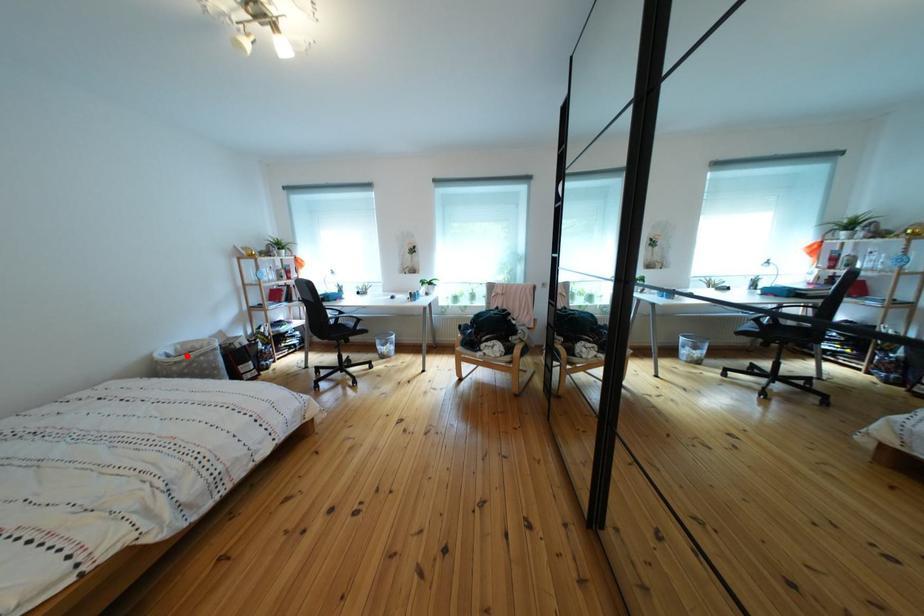
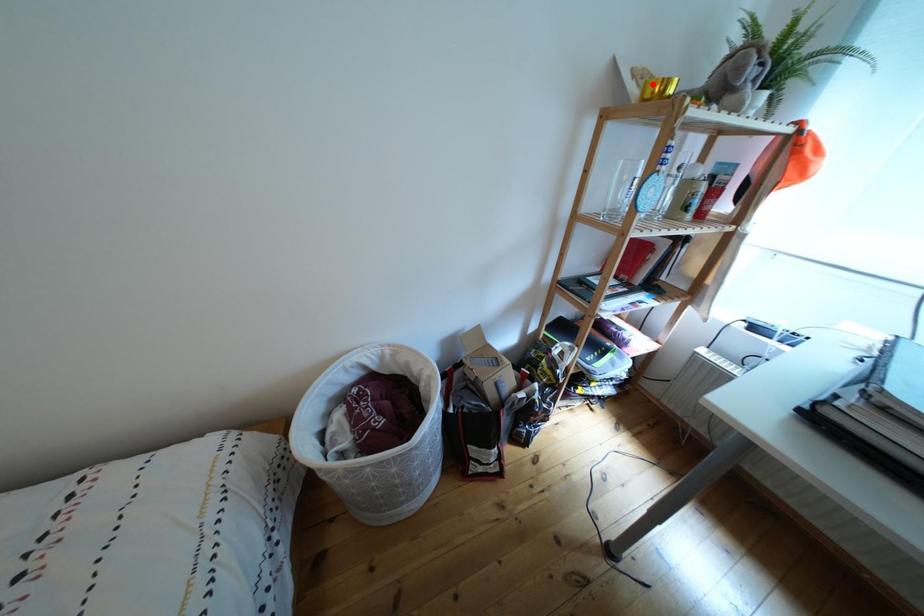
I am providing you with two images of the same scene from different viewpoints. A red point is marked on the first image and another point is marked on the second image. Is the marked point in image1 the same physical position as the marked point in image2?

No